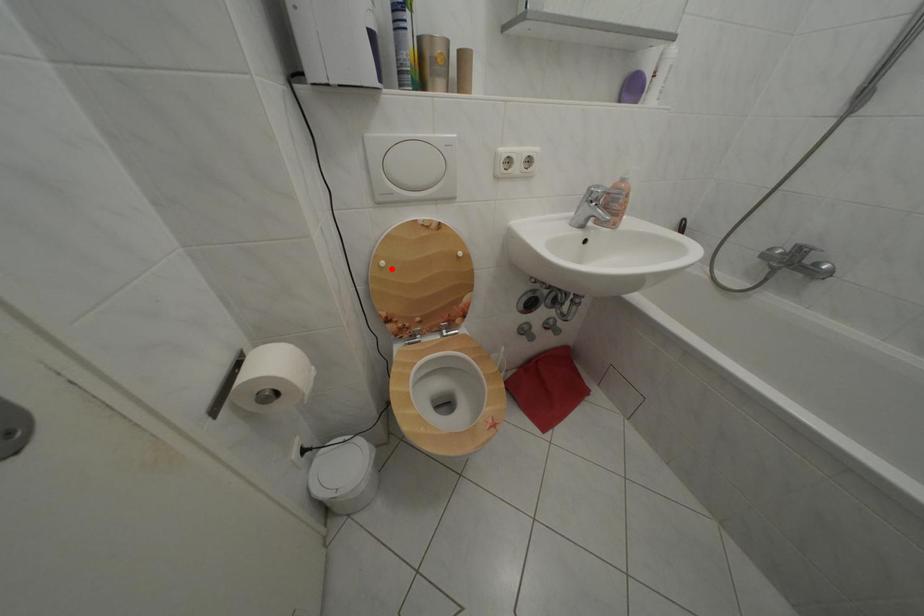
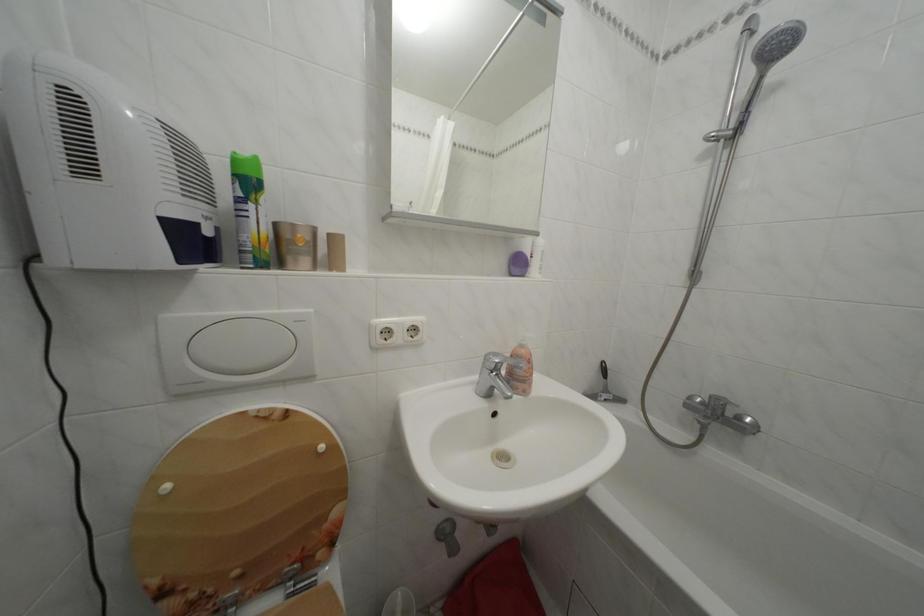
Question: I am providing you with two images of the same scene from different viewpoints. A red point is shown in image1. For the corresponding object point in image2, is it positioned nearer or farther from the camera?

Choices:
 (A) Nearer
 (B) Farther

Answer: (B)